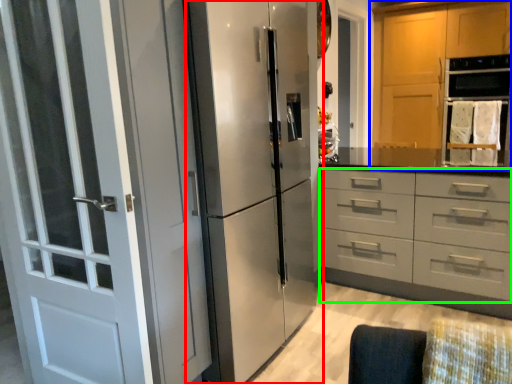
Question: Which is nearer to the refrigerator (highlighted by a red box)? cabinetry (highlighted by a blue box) or drawer (highlighted by a green box).

Choices:
 (A) cabinetry
 (B) drawer

Answer: (B)